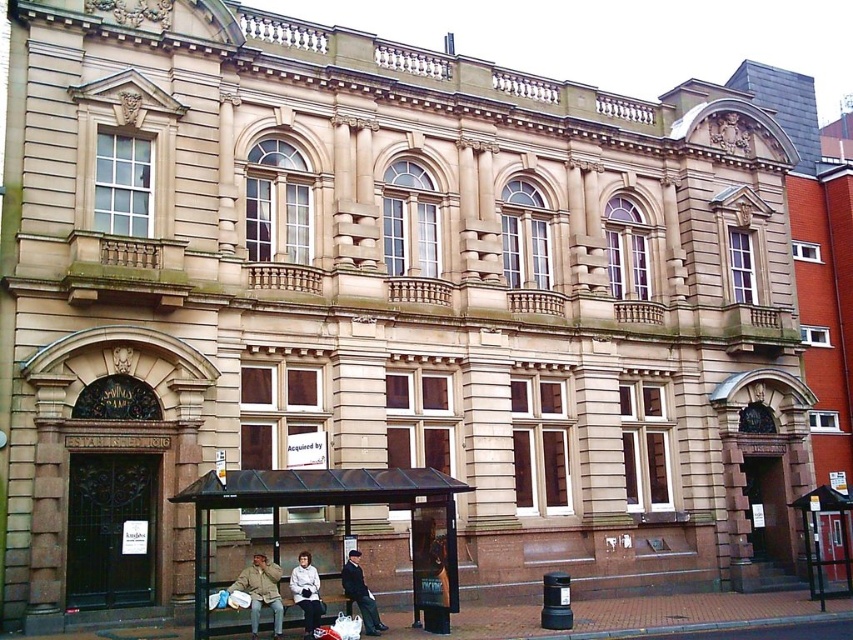
You are standing in front of the grand classical building and want to walk from the point at coordinates point (242,481) to the point at coordinates point (274,595). Which direction should you face to walk towards the second point?

Since point (242,481) is in front of point (274,595), you should face backward to walk towards the second point.

You are a pedestrian carrying a large package and need to reach the white fabric coat at lower center from the black metal bus stop at lower left. The package requires a minimum of 3 meters of space to move comfortably. Can you navigate the path between them without obstacles?

The distance between the black metal bus stop at lower left and the white fabric coat at lower center is 4.19 meters, which is more than the required 3 meters of space. Therefore, you can comfortably navigate the path between them without obstacles.

You are standing in front of the classical building and notice the black metal bus stop at lower left and the white fabric coat at lower center. Which object is positioned higher from the ground?

The black metal bus stop at lower left is above the white fabric coat at lower center, so it is positioned higher from the ground.